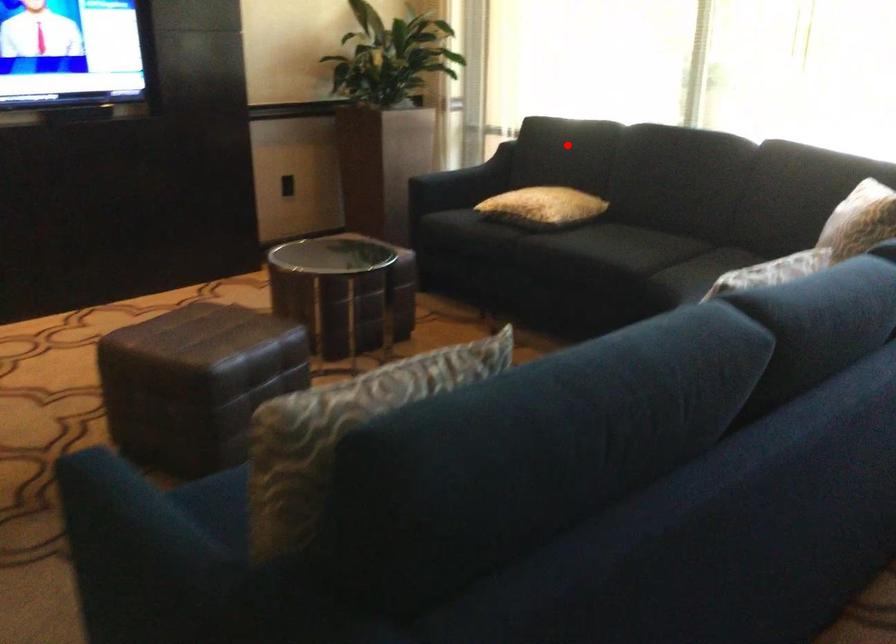
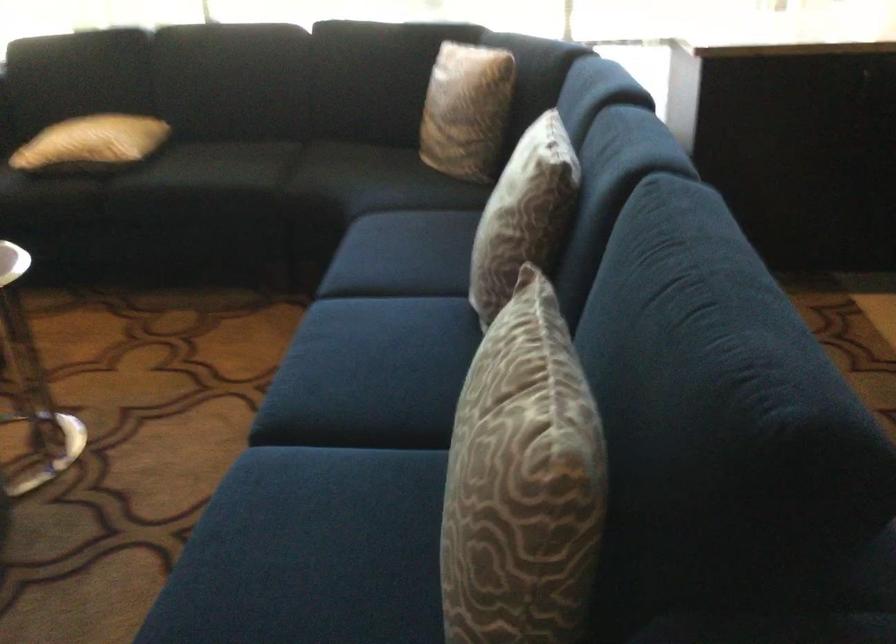
In the second image, find the point that corresponds to the highlighted location in the first image.

(82, 64)